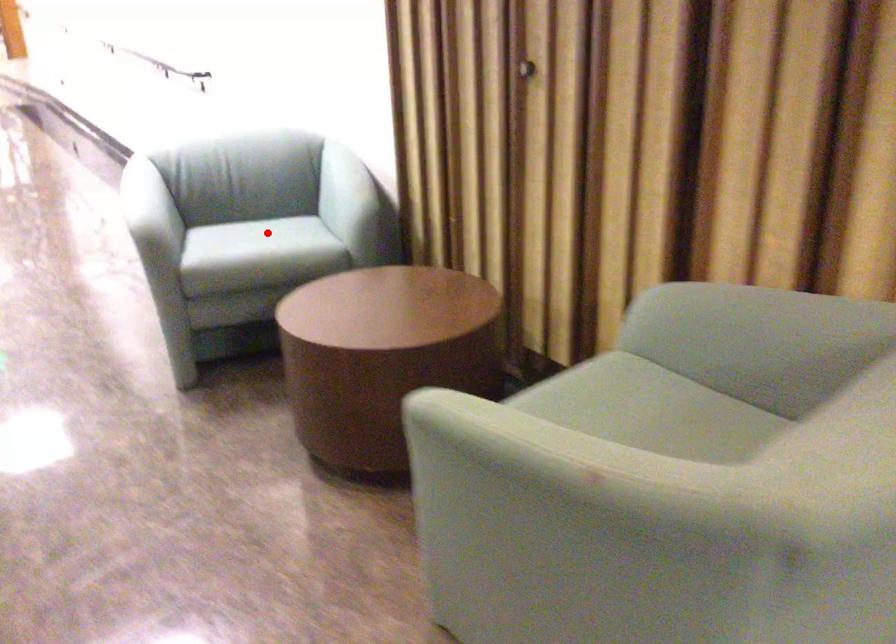
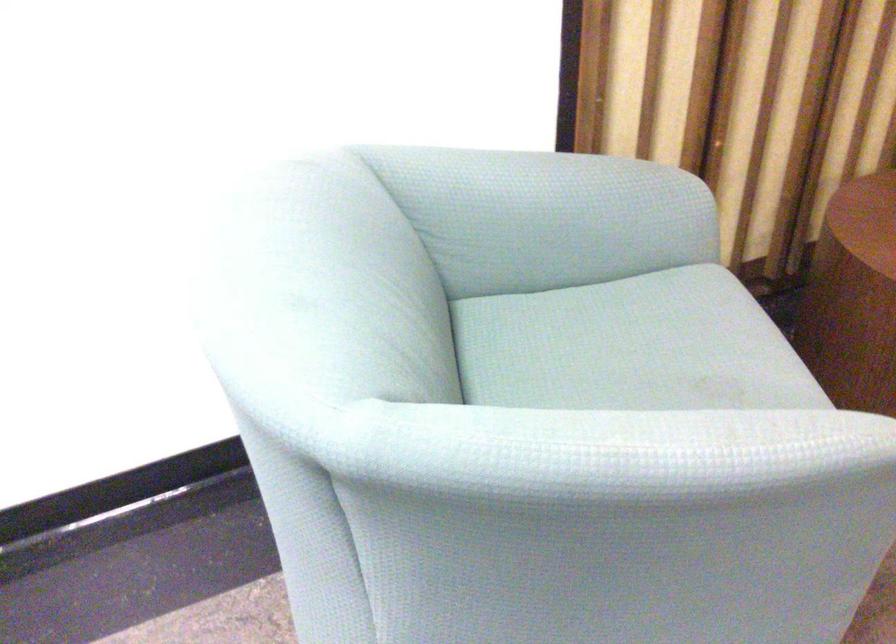
Question: A red point is marked in image1. In image2, is the corresponding 3D point closer to the camera or farther? Reply with the corresponding letter.

Choices:
 (A) The corresponding 3D point is closer.
 (B) The corresponding 3D point is farther.

Answer: (A)